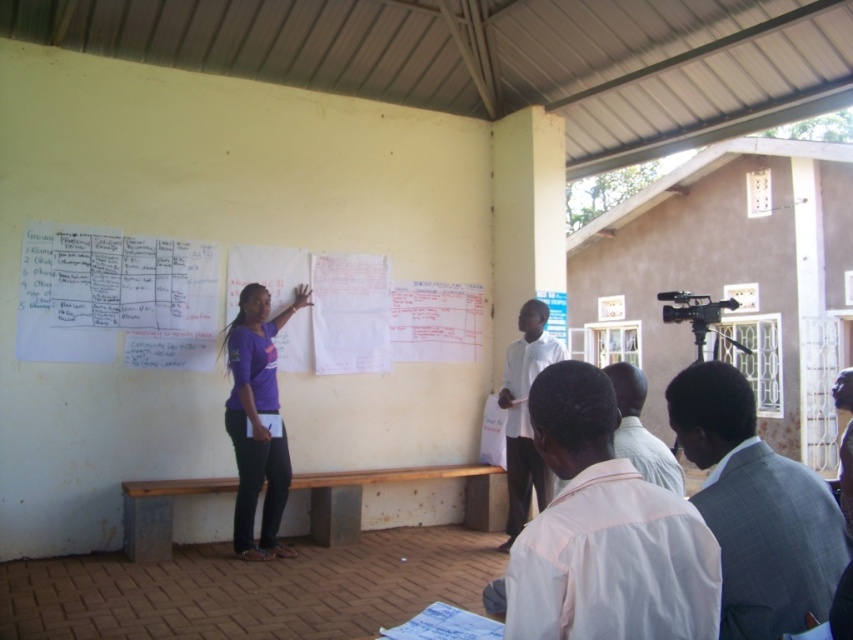
Is point (518, 536) behind point (808, 513)?

No, it is in front of (808, 513).

Locate an element on the screen. white cotton shirt at lower right is located at coordinates (605, 532).

The height and width of the screenshot is (640, 853). Find the location of `white cotton shirt at lower right`. white cotton shirt at lower right is located at coordinates (605, 532).

Does point (752, 602) come in front of point (659, 451)?

Yes, point (752, 602) is in front of point (659, 451).

Is gray checkered suit at lower right shorter than white shirt at lower right?

In fact, gray checkered suit at lower right may be taller than white shirt at lower right.

Describe the element at coordinates (756, 508) in the screenshot. I see `gray checkered suit at lower right` at that location.

I want to click on gray checkered suit at lower right, so click(x=756, y=508).

Does gray checkered suit at lower right have a larger size compared to white matte shirt at center?

Incorrect, gray checkered suit at lower right is not larger than white matte shirt at center.

Can you confirm if gray checkered suit at lower right is wider than white matte shirt at center?

No.

Between point (788, 596) and point (502, 404), which one is positioned behind?

Positioned behind is point (502, 404).

This screenshot has height=640, width=853. Find the location of `gray checkered suit at lower right`. gray checkered suit at lower right is located at coordinates (756, 508).